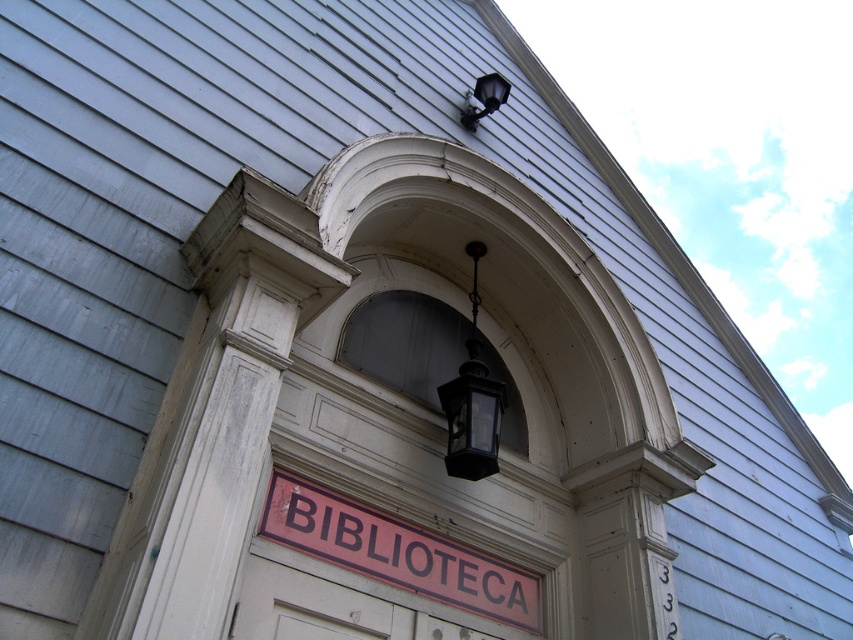
Question: Is white wooden door at center to the right of black glass lantern at upper center from the viewer's perspective?

Choices:
 (A) no
 (B) yes

Answer: (A)

Question: Does red matte sign at center have a larger size compared to black glass lamp at upper center?

Choices:
 (A) yes
 (B) no

Answer: (A)

Question: Based on their relative distances, which object is farther from the black glass lamp at upper center?

Choices:
 (A) black glass lantern at upper center
 (B) white wooden door at center
 (C) red matte sign at center

Answer: (B)

Question: Which object is the closest to the white wooden door at center?

Choices:
 (A) red matte sign at center
 (B) black glass lamp at upper center
 (C) black glass lantern at upper center

Answer: (A)

Question: Does white wooden door at center come behind black glass lamp at upper center?

Choices:
 (A) no
 (B) yes

Answer: (A)

Question: Which of the following is the farthest from the observer?

Choices:
 (A) red matte sign at center
 (B) black glass lantern at upper center

Answer: (B)